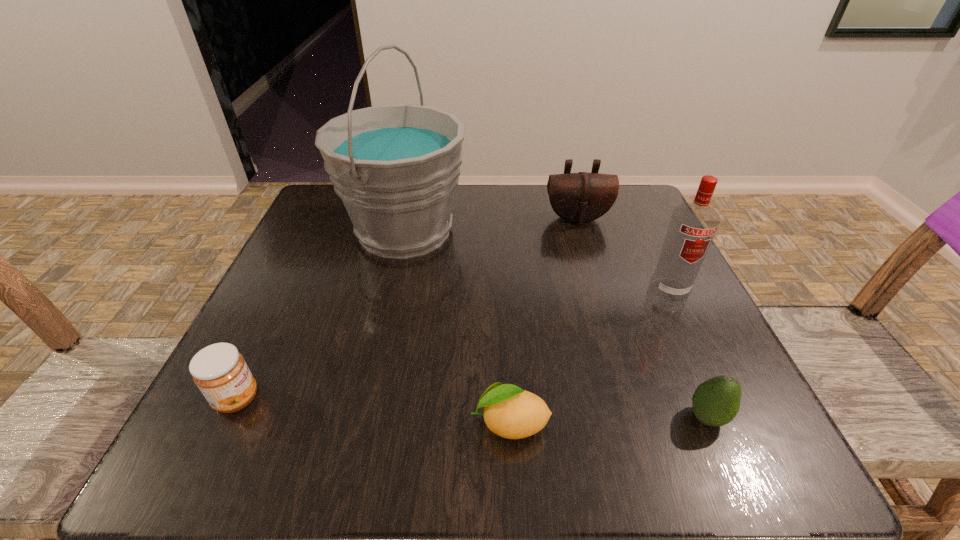
The image size is (960, 540). Find the location of `object that is positioned at the near right corner`. object that is positioned at the near right corner is located at coordinates (715, 402).

The width and height of the screenshot is (960, 540). What are the coordinates of `vacant area at the far edge` in the screenshot? It's located at (544, 239).

In the image, there is a desktop. Find the location of `vacant space at the near edge`. vacant space at the near edge is located at coordinates pos(394,418).

In the image, there is a desktop. Where is `vacant space at the left edge`? This screenshot has height=540, width=960. vacant space at the left edge is located at coordinates (317, 345).

At what (x,y) coordinates should I click in order to perform the action: click on vacant region at the right edge of the desktop. Please return your answer as a coordinate pair (x, y). This screenshot has height=540, width=960. Looking at the image, I should click on (701, 322).

Where is `vacant space at the far right corner`? The image size is (960, 540). vacant space at the far right corner is located at coordinates (601, 228).

At what (x,y) coordinates should I click in order to perform the action: click on vacant space that's between the fifth shortest object and the lemon. Please return your answer as a coordinate pair (x, y). This screenshot has height=540, width=960. Looking at the image, I should click on (589, 357).

Where is `unoccupied area between the fifth object from right to left and the second tallest object`? This screenshot has width=960, height=540. unoccupied area between the fifth object from right to left and the second tallest object is located at coordinates (537, 261).

You are a GUI agent. You are given a task and a screenshot of the screen. Output one action in this format:
    pyautogui.click(x=<x>, y=<y>)
    Task: Click on the free space between the tallest object and the third object from left to right
    
    Given the screenshot: What is the action you would take?
    pyautogui.click(x=457, y=327)

What are the coordinates of `free space that is in between the pouch and the jam` in the screenshot? It's located at (407, 308).